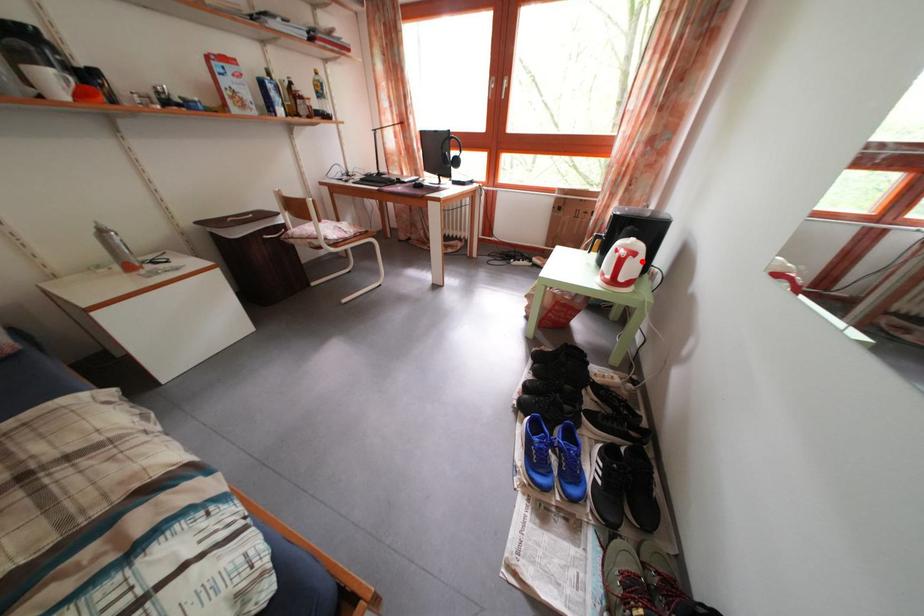
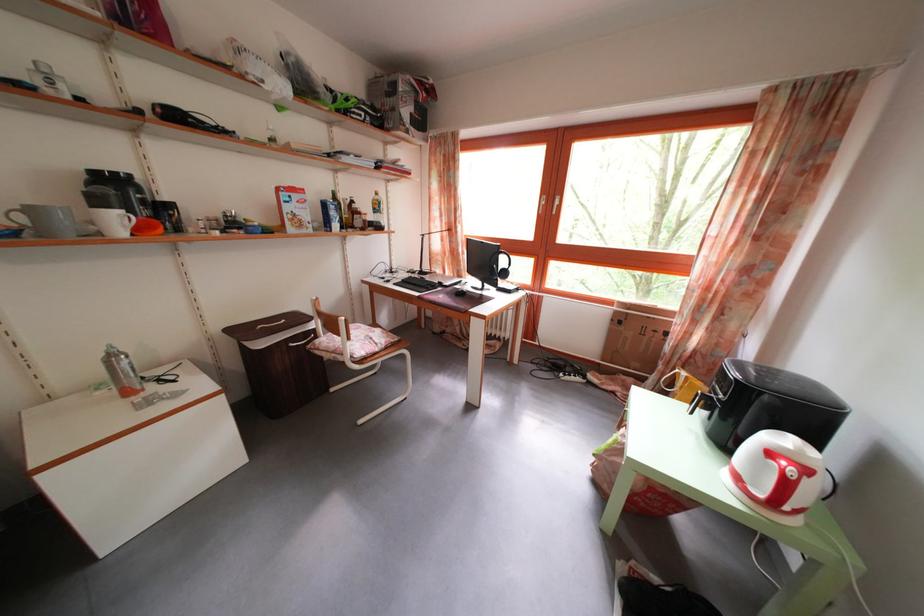
Question: I am providing you with two images of the same scene from different viewpoints. In image1, a red point is highlighted. Considering the same 3D point in image2, which of the following is correct?

Choices:
 (A) It is closer
 (B) It is farther

Answer: (A)